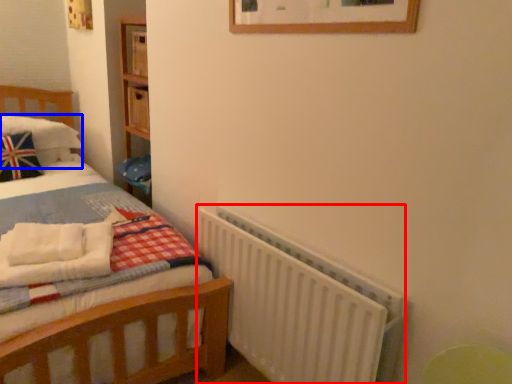
Question: Which of the following is the farthest to the observer, radiator (highlighted by a red box) or pillow (highlighted by a blue box)?

Choices:
 (A) radiator
 (B) pillow

Answer: (B)